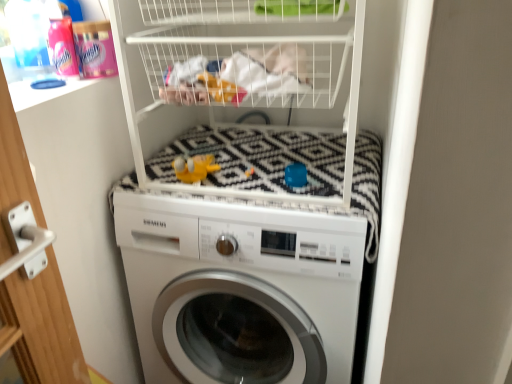
Where is `free space to the right of yellow rubber duck at center`? free space to the right of yellow rubber duck at center is located at coordinates (248, 187).